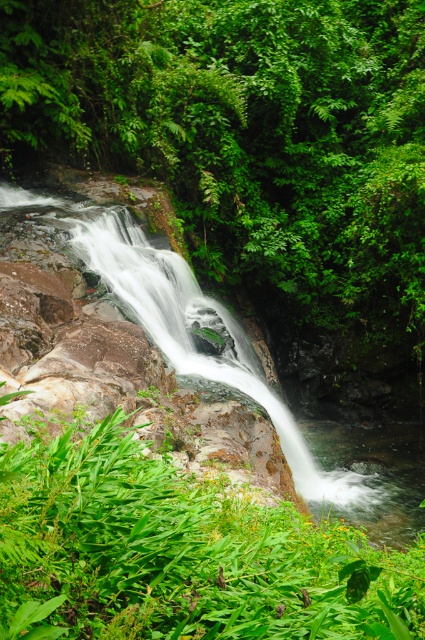
You are a hiker who wants to cross the smooth rock waterfall at center. You notice a green leafy plant at lower left nearby. Which object is bigger in size?

The green leafy plant at lower left is larger in size compared to the smooth rock waterfall at center.

You are a bird looking for a place to perch. You see a green leafy tree at center and a smooth rock waterfall at center. Which location would provide a larger surface for you to land on?

The green leafy tree at center is bigger than the smooth rock waterfall at center, so it would provide a larger surface for you to land on.